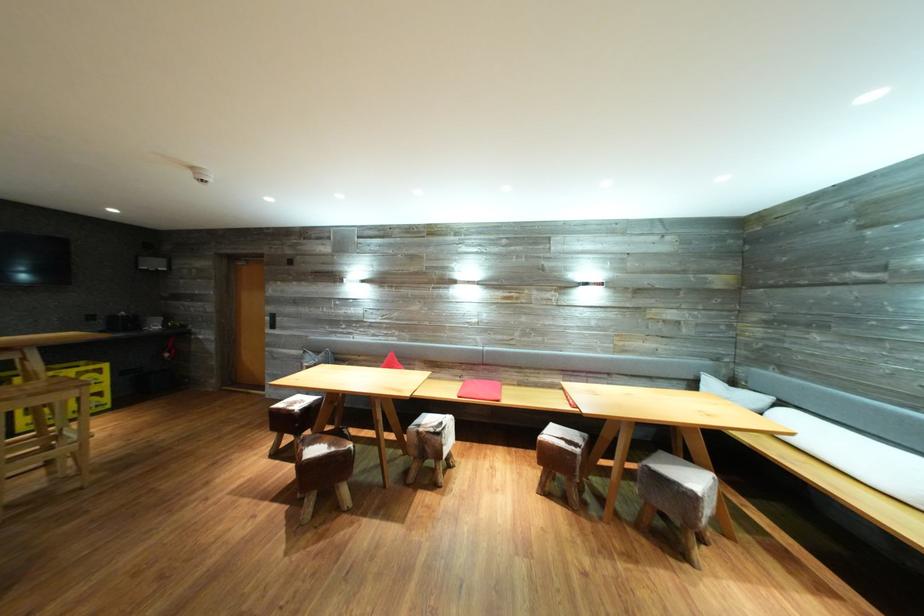
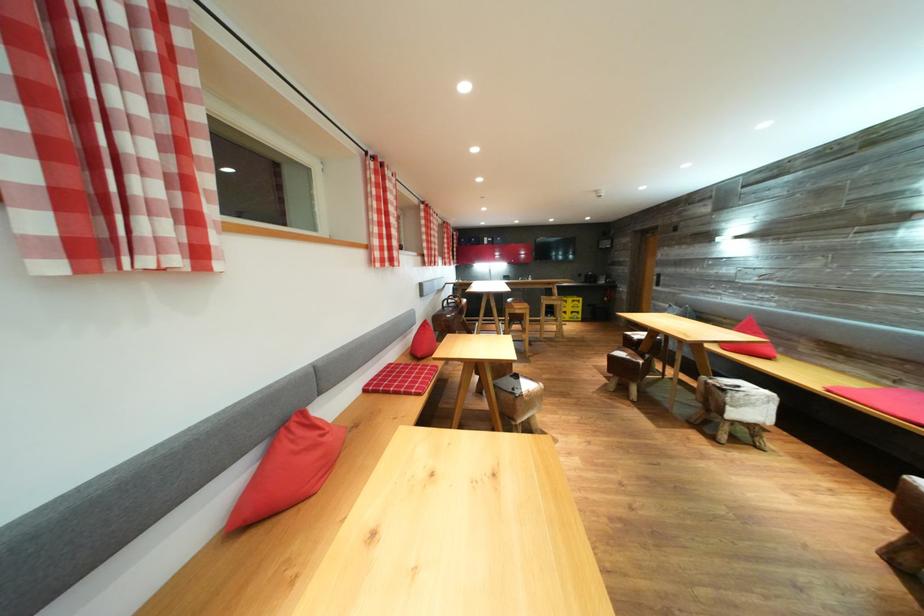
Locate, in the second image, the point that corresponds to point (358, 451) in the first image.

(648, 367)